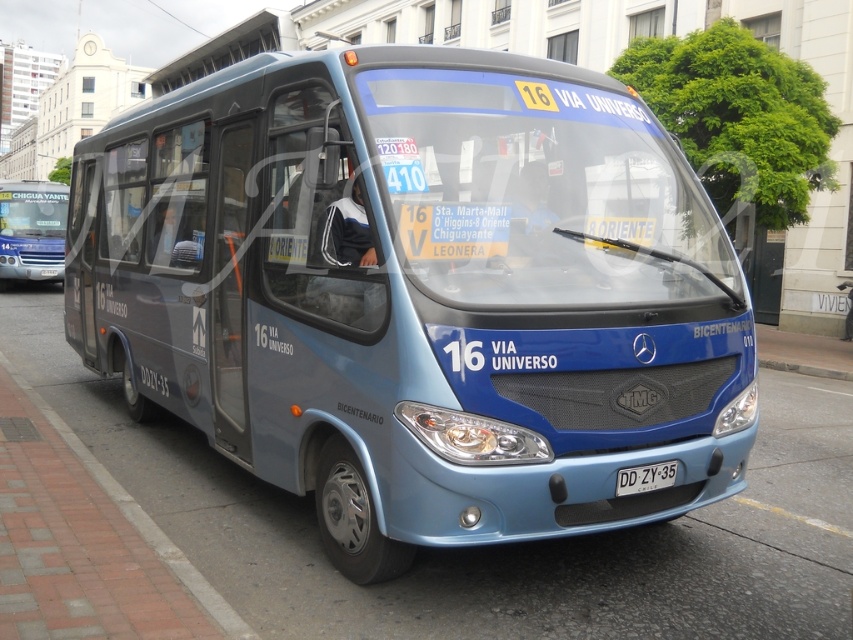
You are standing on the sidewalk next to the brick pavement at lower left, and you want to cross the street to reach the blue Mercedes Benz bus parked ahead. The crosswalk is 4 meters away from your current position. Can you safely reach the bus before the crosswalk ends?

The distance between the brick pavement at lower left and the viewer is 3.52 meters. Since the crosswalk is 4 meters away, you can safely reach the bus before the crosswalk ends because the distance to the bus is shorter than the crosswalk length.

You are standing in front of the blue Mercedes Benz bus labeled 16 VIA UNIVERSO. You notice two points on the bus, one at point coordinate (431, 605) and another at point coordinate (337, 260). Which point is closer to you?

Point coordinate (431, 605) is closer to you than point coordinate (337, 260) because it is closer to the camera.